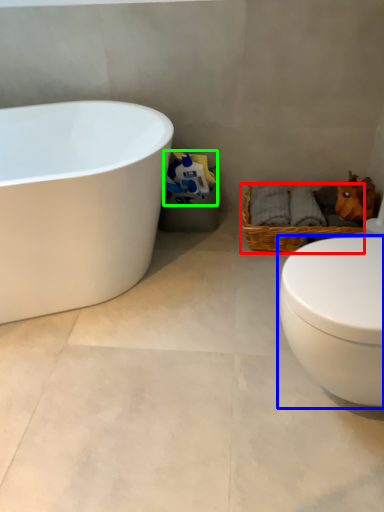
Question: Based on their relative distances, which object is nearer to picnic basket (highlighted by a red box)? Choose from toilet (highlighted by a blue box) and toilet paper (highlighted by a green box).

Choices:
 (A) toilet
 (B) toilet paper

Answer: (B)